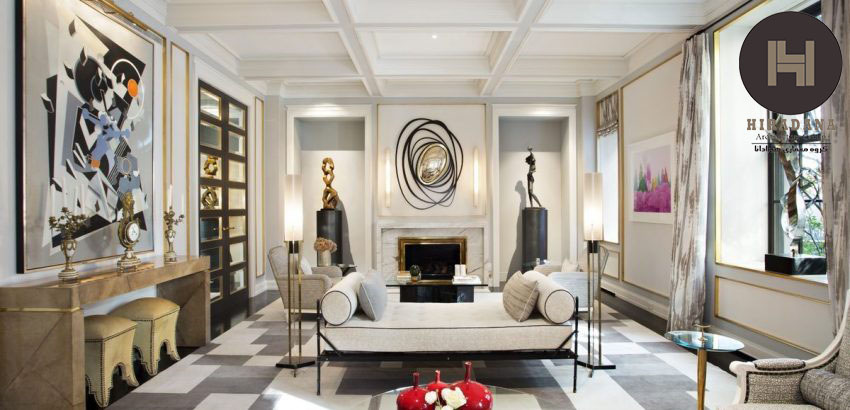
At what (x,y) coordinates should I click in order to perform the action: click on window. Please return your answer as a coordinate pair (x, y). The height and width of the screenshot is (410, 850). Looking at the image, I should click on (816, 182).